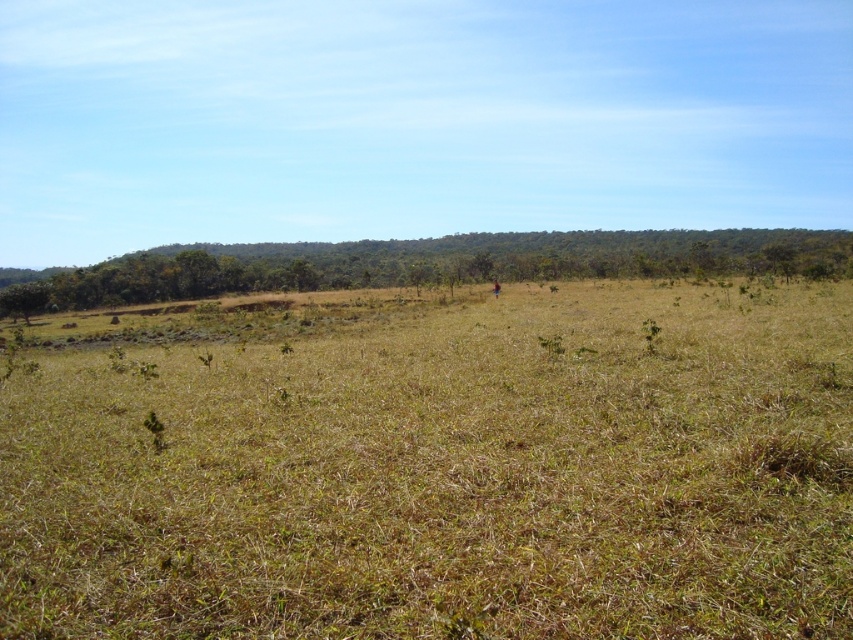
Question: Which object appears closest to the camera in this image?

Choices:
 (A) green leafy tree at upper center
 (B) brown dry grass at center

Answer: (B)

Question: Does brown dry grass at center have a greater width compared to green leafy tree at upper center?

Choices:
 (A) no
 (B) yes

Answer: (A)

Question: Considering the relative positions of brown dry grass at center and green leafy tree at upper center in the image provided, where is brown dry grass at center located with respect to green leafy tree at upper center?

Choices:
 (A) below
 (B) above

Answer: (A)

Question: Among these objects, which one is farthest from the camera?

Choices:
 (A) green leafy tree at upper center
 (B) brown dry grass at center

Answer: (A)

Question: Which point appears farthest from the camera in this image?

Choices:
 (A) (405, 452)
 (B) (450, 272)

Answer: (B)

Question: Does brown dry grass at center have a greater width compared to green leafy tree at upper center?

Choices:
 (A) yes
 (B) no

Answer: (B)